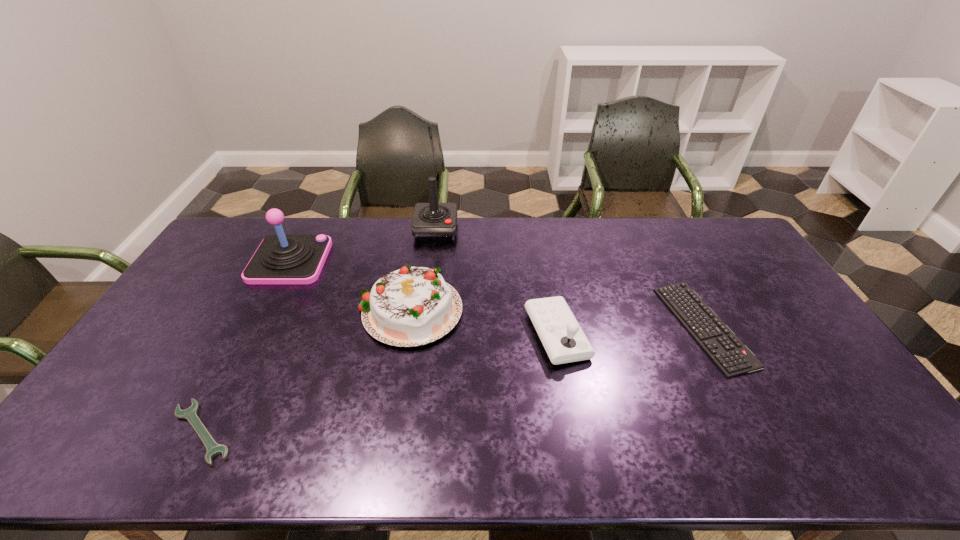
At what (x,y) coordinates should I click in order to perform the action: click on the second joystick from left to right. Please return your answer as a coordinate pair (x, y). This screenshot has height=540, width=960. Looking at the image, I should click on (431, 221).

Find the location of a particular element. The image size is (960, 540). the leftmost joystick is located at coordinates (x=280, y=259).

Where is `the third tallest object`? The width and height of the screenshot is (960, 540). the third tallest object is located at coordinates tap(412, 306).

Locate an element on the screen. the shortest joystick is located at coordinates (561, 335).

This screenshot has width=960, height=540. I want to click on the third shortest object, so click(x=561, y=335).

I want to click on the second shortest object, so click(x=731, y=356).

In order to click on the rightmost object in this screenshot , I will do `click(731, 356)`.

You are a GUI agent. You are given a task and a screenshot of the screen. Output one action in this format:
    pyautogui.click(x=<x>, y=<y>)
    Task: Click on the shortest object
    This screenshot has height=540, width=960.
    Given the screenshot: What is the action you would take?
    pyautogui.click(x=190, y=414)

Find the location of a particular element. The height and width of the screenshot is (540, 960). the nearest object is located at coordinates (190, 414).

Image resolution: width=960 pixels, height=540 pixels. I want to click on free space located 0.240m on the front-facing side of the second joystick from right to left, so click(x=428, y=285).